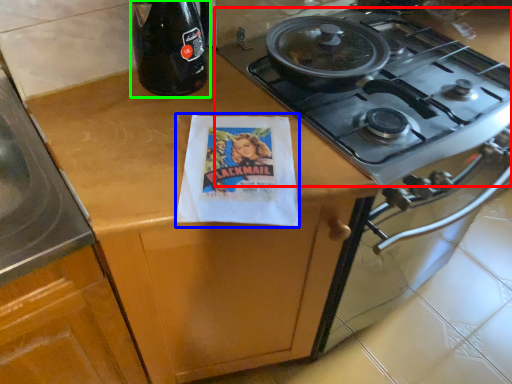
Question: Which is nearer to the gas stove (highlighted by a red box)? flyer (highlighted by a blue box) or bottle (highlighted by a green box).

Choices:
 (A) flyer
 (B) bottle

Answer: (A)